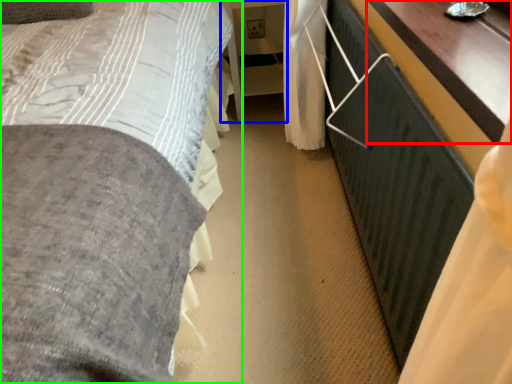
Question: Which object is positioned closest to table (highlighted by a red box)? Select from table (highlighted by a blue box) and bed (highlighted by a green box).

Choices:
 (A) table
 (B) bed

Answer: (B)